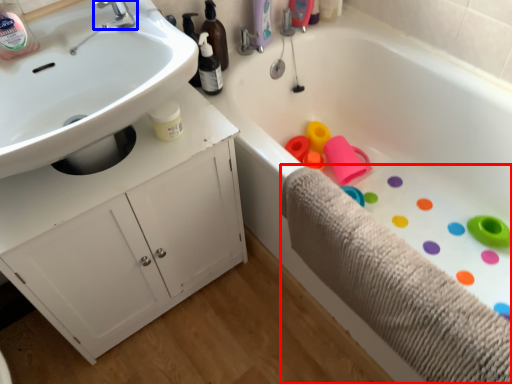
Question: Which point is closer to the camera, bath towel (highlighted by a red box) or tap (highlighted by a blue box)?

Choices:
 (A) bath towel
 (B) tap

Answer: (A)